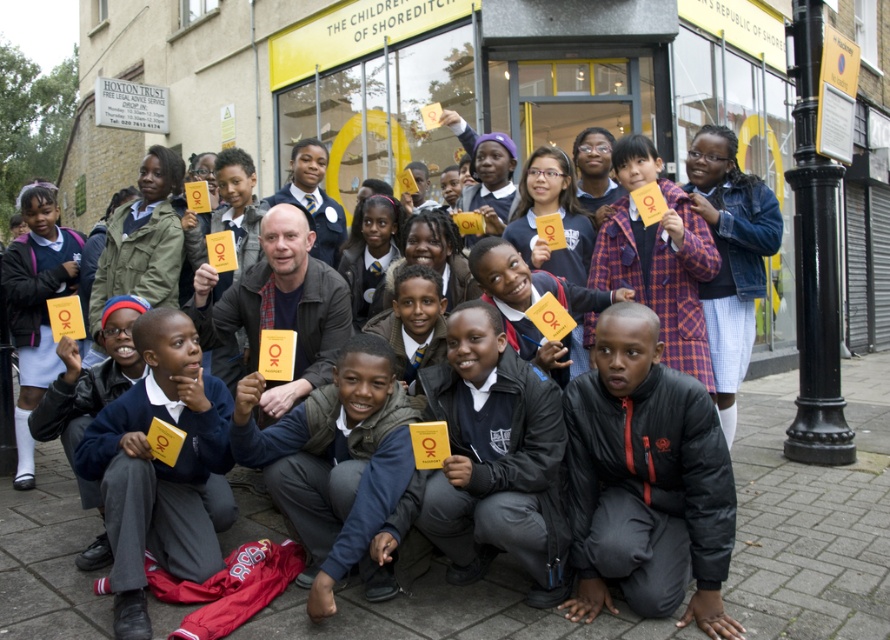
The width and height of the screenshot is (890, 640). In order to click on matte blue uniform at lower left in this screenshot , I will do `click(160, 468)`.

Is matte blue uniform at lower left to the left of matte yellow card at center from the viewer's perspective?

Yes, matte blue uniform at lower left is to the left of matte yellow card at center.

Which is in front, point (143, 384) or point (384, 416)?

Point (384, 416) is in front.

Find the location of a particular element. The height and width of the screenshot is (640, 890). matte blue uniform at lower left is located at coordinates (160, 468).

How far apart are black matte jacket at lower center and matte yellow card at center?

1.01 meters

Who is taller, black matte jacket at lower center or matte yellow card at center?

black matte jacket at lower center

This screenshot has width=890, height=640. Identify the location of black matte jacket at lower center. (646, 481).

Which of these two, black matte jacket at lower center or matte blue uniform at lower left, stands shorter?

Standing shorter between the two is matte blue uniform at lower left.

Describe the element at coordinates (646, 481) in the screenshot. I see `black matte jacket at lower center` at that location.

Locate an element on the screen. The width and height of the screenshot is (890, 640). black matte jacket at lower center is located at coordinates (646, 481).